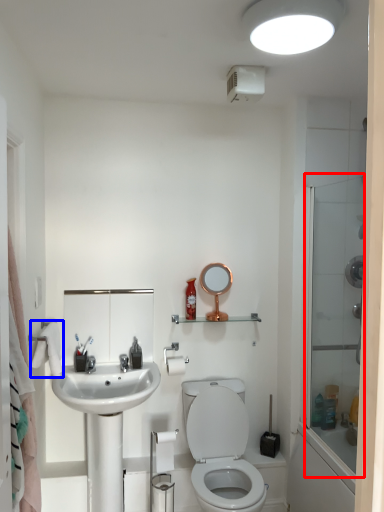
Question: Which object is further to the camera taking this photo, glass door (highlighted by a red box) or bath towel (highlighted by a blue box)?

Choices:
 (A) glass door
 (B) bath towel

Answer: (B)